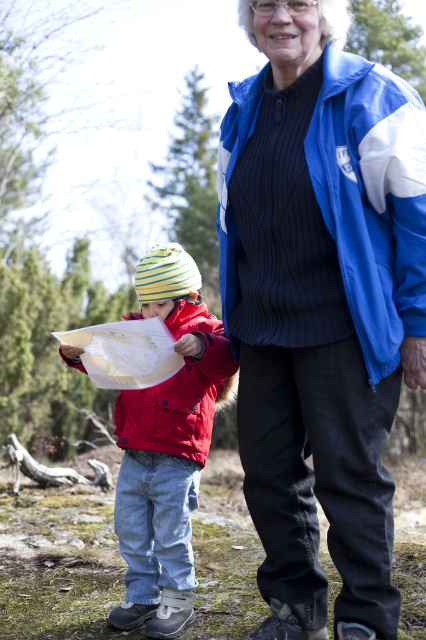
You are a drone operator trying to locate a specific point in an image. The point you need to find is at coordinates point (373, 198). The image shows a blue fabric jacket at upper right. Can you determine if the point is on the blue fabric jacket at upper right?

Yes, the point (373, 198) is on the blue fabric jacket at upper right according to the description.

You are planning to buy a new jacket. You see two jackets in the store, the blue fabric jacket at upper right and the matte red jacket at left. Which one is narrower?

The blue fabric jacket at upper right is narrower than the matte red jacket at left.

You are a hiker trying to decide which jacket to wear for a cold but sunny day. You have the blue fabric jacket at upper right and the matte red jacket at lower left. Which jacket would provide better insulation based on their thickness?

The matte red jacket at lower left is thicker than the blue fabric jacket at upper right, so it would provide better insulation for a cold day.